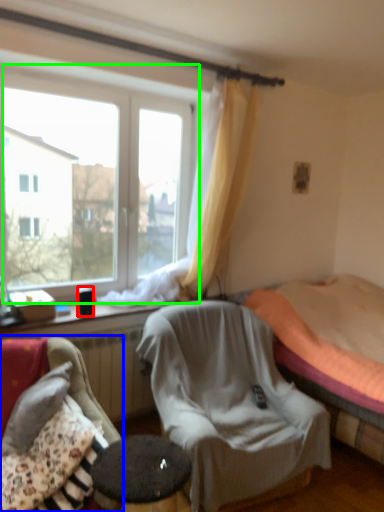
Question: Considering the real-world distances, which object is closest to coffee cup (highlighted by a red box)? chair (highlighted by a blue box) or window (highlighted by a green box).

Choices:
 (A) chair
 (B) window

Answer: (A)